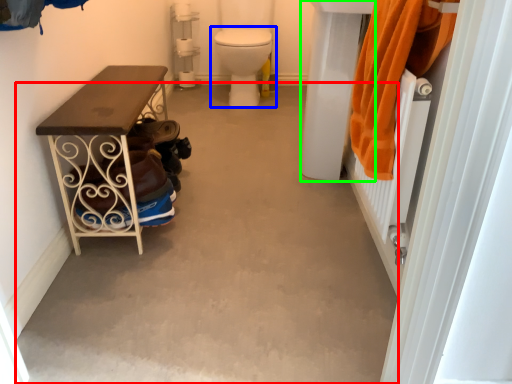
Question: Considering the real-world distances, which object is farthest from concrete (highlighted by a red box)? toilet (highlighted by a blue box) or sink (highlighted by a green box)?

Choices:
 (A) toilet
 (B) sink

Answer: (A)